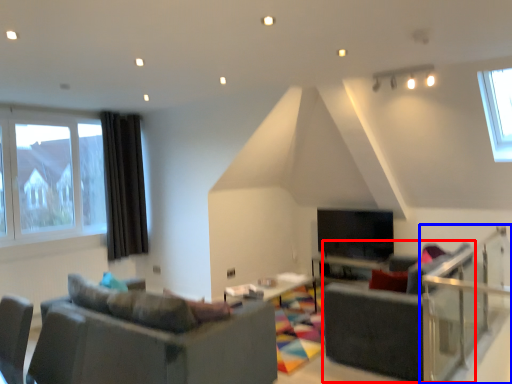
Question: Which of the following is the closest to the observer, armchair (highlighted by a red box) or balustrade (highlighted by a blue box)?

Choices:
 (A) armchair
 (B) balustrade

Answer: (B)